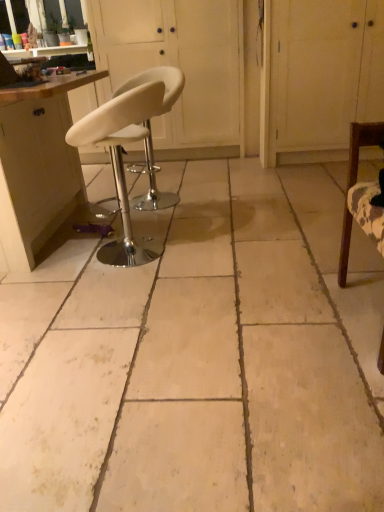
Identify the location of free space that is in between white leather stool at center, acting as the 1th chair starting from the left, and wooden chair at right, arranged as the 1th chair when viewed from the right. This screenshot has height=512, width=384. (247, 287).